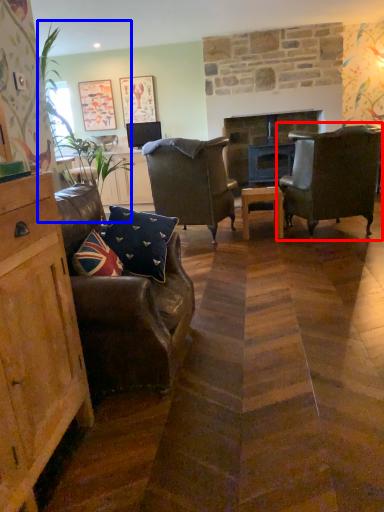
Question: Which point is closer to the camera, chair (highlighted by a red box) or plant (highlighted by a blue box)?

Choices:
 (A) chair
 (B) plant

Answer: (B)